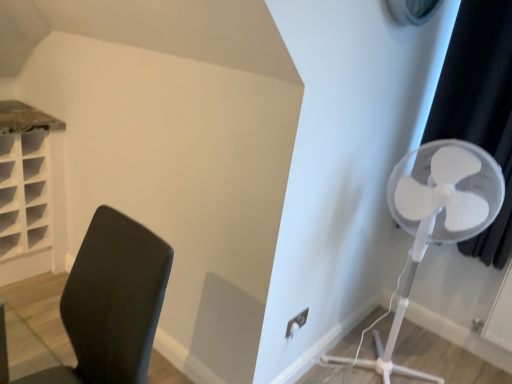
Question: Is there a large distance between white plastic fan at right and black plastic chair at left?

Choices:
 (A) no
 (B) yes

Answer: (B)

Question: From the image's perspective, is white plastic fan at right located beneath black plastic chair at left?

Choices:
 (A) yes
 (B) no

Answer: (B)

Question: Considering the relative positions of white plastic fan at right and black plastic chair at left in the image provided, is white plastic fan at right to the right of black plastic chair at left from the viewer's perspective?

Choices:
 (A) yes
 (B) no

Answer: (A)

Question: Could you tell me if white plastic fan at right is turned towards black plastic chair at left?

Choices:
 (A) no
 (B) yes

Answer: (B)

Question: From a real-world perspective, is white plastic fan at right on black plastic chair at left?

Choices:
 (A) no
 (B) yes

Answer: (B)

Question: Is white plastic fan at right closer to the viewer compared to black plastic chair at left?

Choices:
 (A) no
 (B) yes

Answer: (A)

Question: From the image's perspective, is black plastic chair at left beneath black fabric curtain at right?

Choices:
 (A) yes
 (B) no

Answer: (A)

Question: Does black plastic chair at left have a greater width compared to black fabric curtain at right?

Choices:
 (A) no
 (B) yes

Answer: (B)

Question: Does black plastic chair at left contain black fabric curtain at right?

Choices:
 (A) no
 (B) yes

Answer: (A)

Question: Is black plastic chair at left oriented towards black fabric curtain at right?

Choices:
 (A) no
 (B) yes

Answer: (A)

Question: From a real-world perspective, is black plastic chair at left on black fabric curtain at right?

Choices:
 (A) yes
 (B) no

Answer: (B)

Question: From the image's perspective, does black plastic chair at left appear higher than black fabric curtain at right?

Choices:
 (A) no
 (B) yes

Answer: (A)

Question: From a real-world perspective, is black plastic chair at left below white plastic fan at right?

Choices:
 (A) no
 (B) yes

Answer: (B)